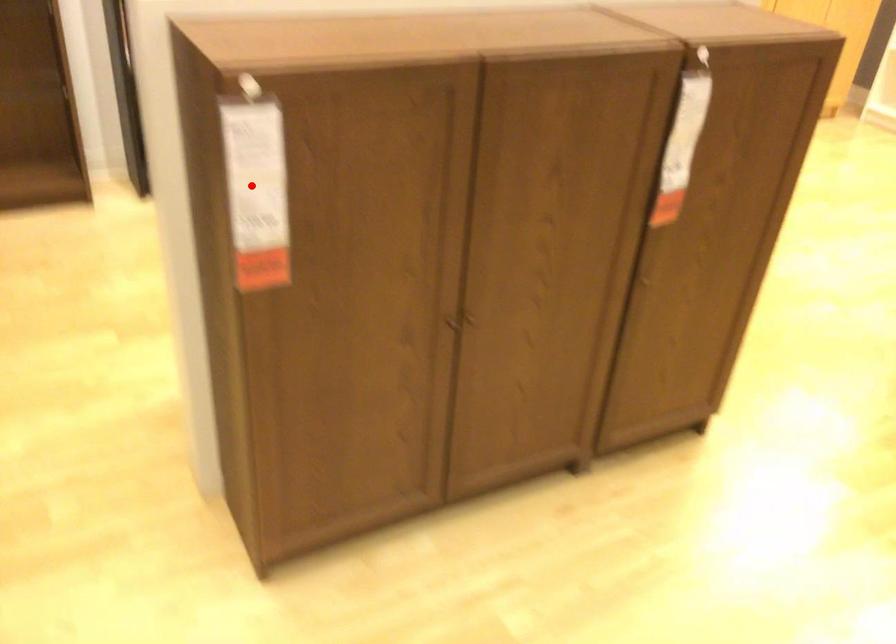
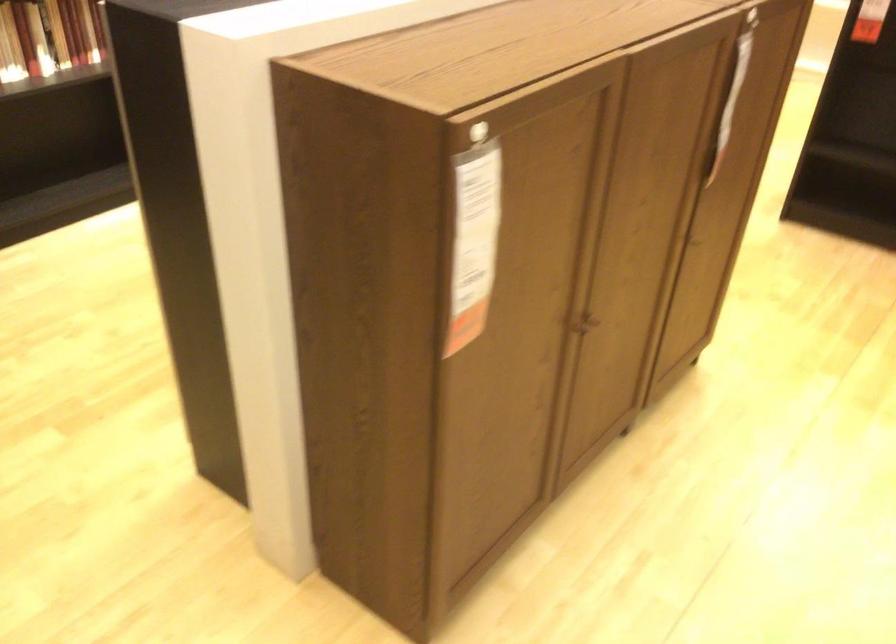
Question: I am providing you with two images of the same scene from different viewpoints. A red point is shown in image1. For the corresponding object point in image2, is it positioned nearer or farther from the camera?

Choices:
 (A) Nearer
 (B) Farther

Answer: (A)